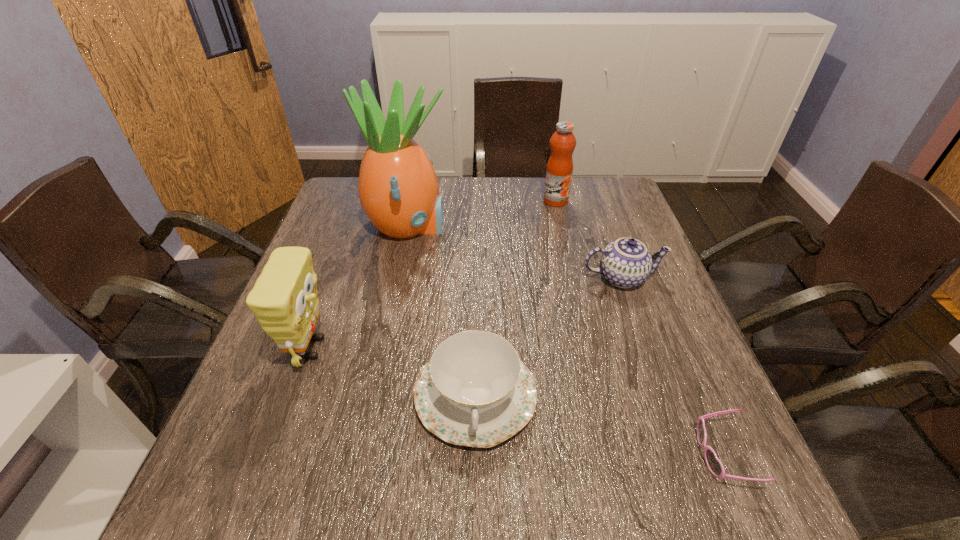
Where is `pineapple`? This screenshot has height=540, width=960. pineapple is located at coordinates (398, 189).

Locate an element on the screen. The height and width of the screenshot is (540, 960). fruit juice is located at coordinates (559, 170).

This screenshot has width=960, height=540. Identify the location of sponge. (284, 299).

This screenshot has width=960, height=540. Identify the location of the third farthest object. (625, 263).

Locate an element on the screen. This screenshot has height=540, width=960. the taller chinaware is located at coordinates (625, 263).

You are a GUI agent. You are given a task and a screenshot of the screen. Output one action in this format:
    pyautogui.click(x=<x>, y=<y>)
    Task: Click on the nearer chinaware
    Image resolution: width=960 pixels, height=540 pixels.
    Given the screenshot: What is the action you would take?
    pyautogui.click(x=475, y=391)

At what (x,y) coordinates should I click in order to perform the action: click on the shorter chinaware. Please return your answer as a coordinate pair (x, y). Looking at the image, I should click on (475, 391).

Locate an element on the screen. The width and height of the screenshot is (960, 540). the shortest object is located at coordinates (714, 465).

Find the location of a particular element. Image resolution: width=960 pixels, height=540 pixels. free space located at the entrance of the tallest object is located at coordinates coord(513,228).

I want to click on free space located 0.400m on the front label of the fruit juice, so click(579, 300).